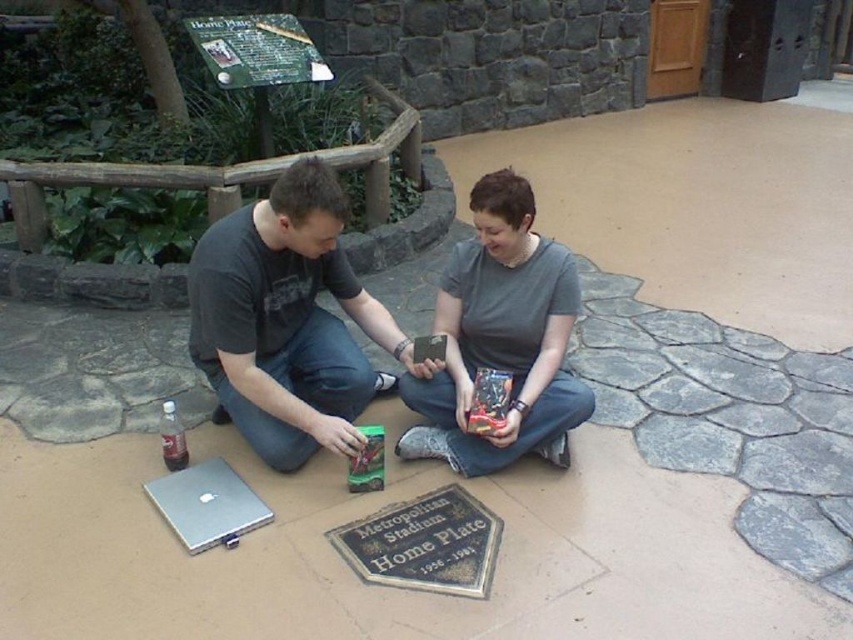
Is gray matte shirt at center to the left of silver metallic laptop at lower left from the viewer's perspective?

No, gray matte shirt at center is not to the left of silver metallic laptop at lower left.

Looking at this image, does gray matte shirt at center have a lesser width compared to silver metallic laptop at lower left?

In fact, gray matte shirt at center might be wider than silver metallic laptop at lower left.

Is point (457, 352) in front of point (222, 499)?

No, (457, 352) is further to viewer.

The height and width of the screenshot is (640, 853). What are the coordinates of `gray matte shirt at center` in the screenshot? It's located at (502, 339).

Who is taller, dark gray matte shirt at center or gray matte shirt at center?

With more height is gray matte shirt at center.

This screenshot has height=640, width=853. What are the coordinates of `dark gray matte shirt at center` in the screenshot? It's located at (288, 321).

Does point (317, 157) come behind point (527, 276)?

Yes, point (317, 157) is farther from viewer.

This screenshot has height=640, width=853. I want to click on dark gray matte shirt at center, so click(x=288, y=321).

Does dark gray matte shirt at center appear on the left side of silver metallic laptop at lower left?

Incorrect, dark gray matte shirt at center is not on the left side of silver metallic laptop at lower left.

Which is more to the left, dark gray matte shirt at center or silver metallic laptop at lower left?

silver metallic laptop at lower left

What do you see at coordinates (288, 321) in the screenshot? This screenshot has height=640, width=853. I see `dark gray matte shirt at center` at bounding box center [288, 321].

Find the location of a particular element. dark gray matte shirt at center is located at coordinates (288, 321).